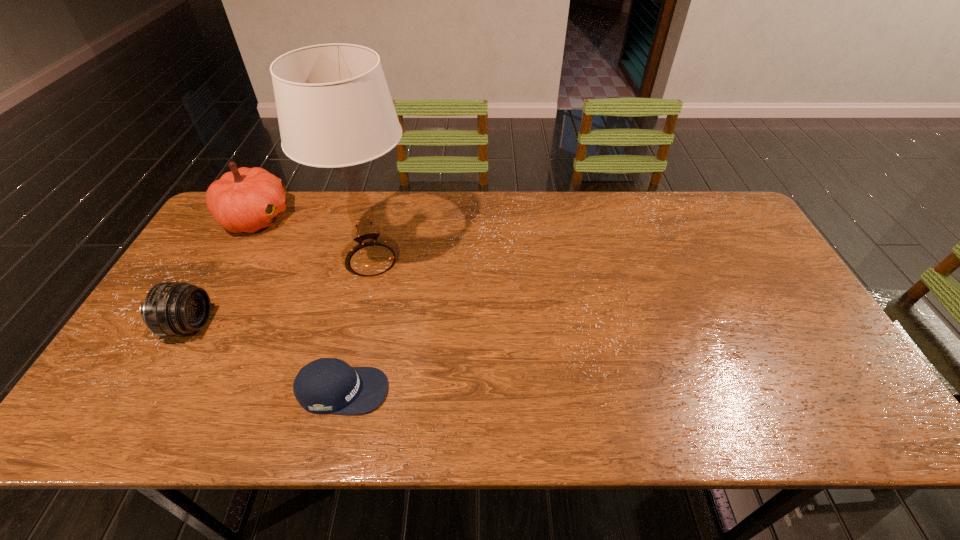
The width and height of the screenshot is (960, 540). Find the location of `object that is the closest to the pumpkin`. object that is the closest to the pumpkin is located at coordinates (334, 108).

Choose which object is the nearest neighbor to the third tallest object. Please provide its 2D coordinates. Your answer should be formatted as a tuple, i.e. [(x, y)], where the tuple contains the x and y coordinates of a point satisfying the conditions above.

[(334, 108)]